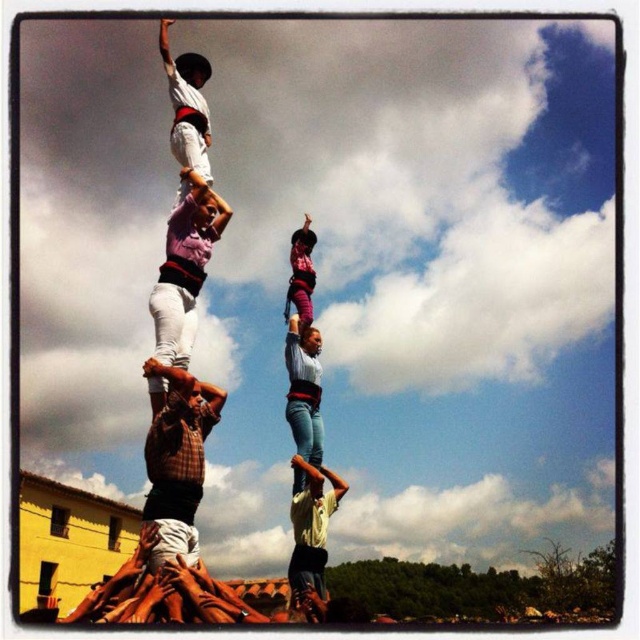
Does white cotton shirt at center have a greater height compared to pink fabric at center?

Correct, white cotton shirt at center is much taller as pink fabric at center.

Does white cotton shirt at center have a smaller size compared to pink fabric at center?

No, white cotton shirt at center is not smaller than pink fabric at center.

Which is behind, point (154, 307) or point (289, 257)?

Positioned behind is point (289, 257).

Locate an element on the screen. white cotton shirt at center is located at coordinates (184, 268).

Between blue jeans at center and pink fabric at center, which one is positioned higher?

pink fabric at center is higher up.

Which is behind, point (300, 364) or point (300, 289)?

Point (300, 289)

Who is more forward, (316, 416) or (296, 282)?

Point (316, 416) is more forward.

You are a GUI agent. You are given a task and a screenshot of the screen. Output one action in this format:
    pyautogui.click(x=<x>, y=<y>)
    Task: Click on the blue jeans at center
    
    Given the screenshot: What is the action you would take?
    pyautogui.click(x=304, y=390)

Does light yellow shirt at center have a lesser width compared to white cotton shirt at upper center?

Yes, light yellow shirt at center is thinner than white cotton shirt at upper center.

Between point (310, 596) and point (173, 116), which one is positioned in front?

Point (310, 596) is in front.

Is point (292, 588) more distant than point (160, 26)?

No, (292, 588) is closer to viewer.

The image size is (640, 640). I want to click on light yellow shirt at center, so click(x=310, y=538).